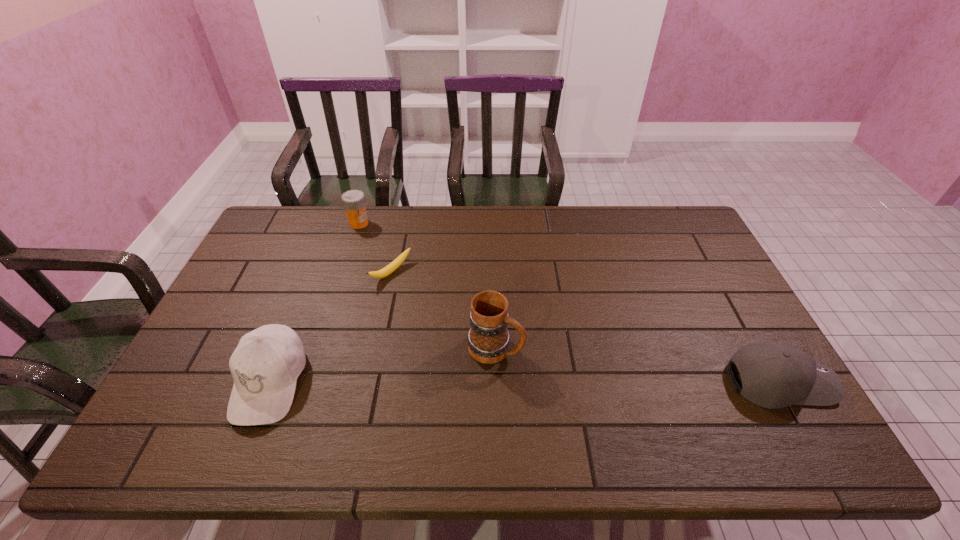
Where is `vacant space on the desktop that is between the left baseball cap and the rightmost object and is positioned on the upward curve of the banana`? vacant space on the desktop that is between the left baseball cap and the rightmost object and is positioned on the upward curve of the banana is located at coordinates (554, 382).

At what (x,y) coordinates should I click in order to perform the action: click on free space on the desktop that is between the left baseball cap and the right baseball cap and is positioned on the label side of the medicine. Please return your answer as a coordinate pair (x, y). The image size is (960, 540). Looking at the image, I should click on (452, 382).

Locate an element on the screen. vacant spot on the desktop that is between the left baseball cap and the rightmost object and is positioned on the side of the tallest object with the handle is located at coordinates (568, 382).